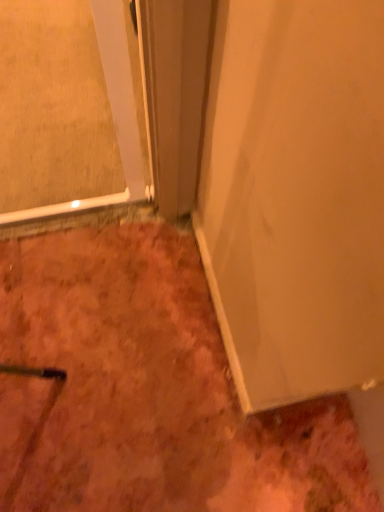
At what (x,y) coordinates should I click in order to perform the action: click on dull orange carpet at lower left. Please return your answer as a coordinate pair (x, y). The image size is (384, 512). Looking at the image, I should click on (148, 391).

The width and height of the screenshot is (384, 512). I want to click on clear glass door at upper left, so click(x=112, y=117).

Is white matte door at center inside the boundaries of clear glass door at upper left, or outside?

white matte door at center exists outside the volume of clear glass door at upper left.

Is white matte door at center at the right side of clear glass door at upper left?

Correct, you'll find white matte door at center to the right of clear glass door at upper left.

Is point (336, 151) behind point (124, 40)?

No, it is in front of (124, 40).

Consider the image. From a real-world perspective, does white matte door at center stand above clear glass door at upper left?

Correct, in the physical world, white matte door at center is higher than clear glass door at upper left.

Is dull orange carpet at lower left directly adjacent to white matte door at center?

No, dull orange carpet at lower left is not in contact with white matte door at center.

Does point (160, 452) appear closer or farther from the camera than point (313, 54)?

Point (160, 452) appears to be farther away from the viewer than point (313, 54).

Does dull orange carpet at lower left have a larger size compared to white matte door at center?

Indeed, dull orange carpet at lower left has a larger size compared to white matte door at center.

Between point (295, 227) and point (68, 420), which one is positioned behind?

The point (68, 420) is more distant.

Considering the relative sizes of white matte door at center and dull orange carpet at lower left in the image provided, is white matte door at center bigger than dull orange carpet at lower left?

No.

What are the coordinates of `dirt lying on the left of white matte door at center` in the screenshot? It's located at (148, 391).

Is dull orange carpet at lower left inside white matte door at center?

Actually, dull orange carpet at lower left is outside white matte door at center.

Which is nearer, (40, 345) or (120, 112)?

The point (120, 112) is in front.

Is dull orange carpet at lower left in front of clear glass door at upper left?

No, the depth of dull orange carpet at lower left is greater than that of clear glass door at upper left.

Is dull orange carpet at lower left to the left or to the right of clear glass door at upper left in the image?

In the image, dull orange carpet at lower left appears on the right side of clear glass door at upper left.

Is clear glass door at upper left facing towards white matte door at center?

No.

Which is closer to the camera, (112,66) or (272,88)?

Clearly, point (112,66) is more distant from the camera than point (272,88).

Is clear glass door at upper left in front of or behind white matte door at center in the image?

Visually, clear glass door at upper left is located behind white matte door at center.

Is clear glass door at upper left completely or partially outside of dull orange carpet at lower left?

That's correct, clear glass door at upper left is outside of dull orange carpet at lower left.

Is clear glass door at upper left to the right of dull orange carpet at lower left from the viewer's perspective?

No, clear glass door at upper left is not to the right of dull orange carpet at lower left.

Where is `dirt directly beneath the clear glass door at upper left (from a real-world perspective)`? The image size is (384, 512). dirt directly beneath the clear glass door at upper left (from a real-world perspective) is located at coordinates (148, 391).

From a real-world perspective, is clear glass door at upper left located higher than dull orange carpet at lower left?

Yes, from a real-world perspective, clear glass door at upper left is above dull orange carpet at lower left.

The image size is (384, 512). Identify the location of glass door above the white matte door at center (from the image's perspective). (112, 117).

The height and width of the screenshot is (512, 384). In order to click on door on the right of dull orange carpet at lower left in this screenshot , I will do `click(295, 196)`.

When comparing their distances from white matte door at center, does dull orange carpet at lower left or clear glass door at upper left seem closer?

Based on the image, clear glass door at upper left appears to be nearer to white matte door at center.

Which object lies nearer to the anchor point clear glass door at upper left, dull orange carpet at lower left or white matte door at center?

white matte door at center is positioned closer to the anchor clear glass door at upper left.

When comparing their distances from dull orange carpet at lower left, does clear glass door at upper left or white matte door at center seem further?

The object further to dull orange carpet at lower left is clear glass door at upper left.

When comparing their distances from white matte door at center, does clear glass door at upper left or dull orange carpet at lower left seem closer?

clear glass door at upper left is positioned closer to the anchor white matte door at center.

Looking at this image, from the image, which object appears to be nearer to clear glass door at upper left, white matte door at center or dull orange carpet at lower left?

white matte door at center.

Which object lies nearer to the anchor point dull orange carpet at lower left, white matte door at center or clear glass door at upper left?

white matte door at center is closer to dull orange carpet at lower left.

I want to click on glass door positioned between white matte door at center and dull orange carpet at lower left from near to far, so click(x=112, y=117).